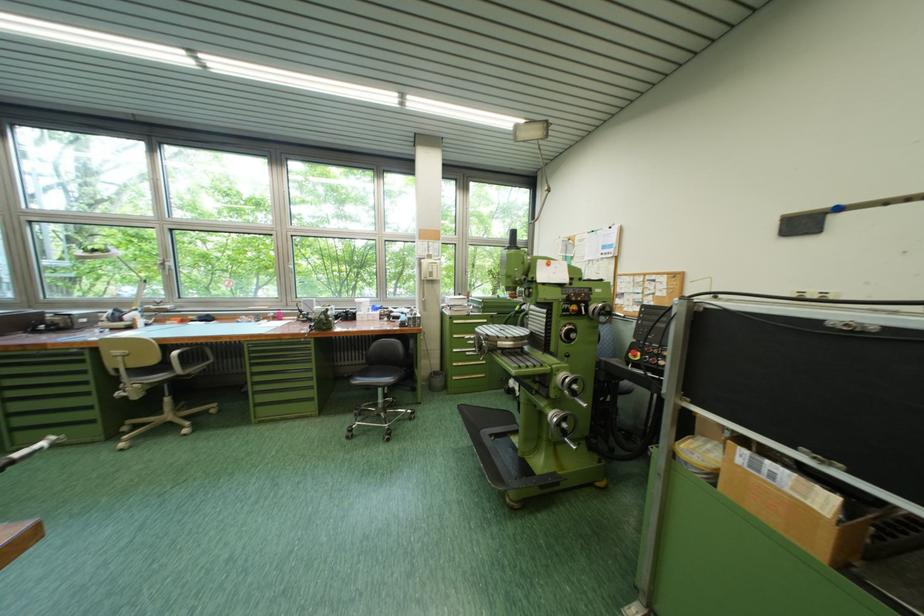
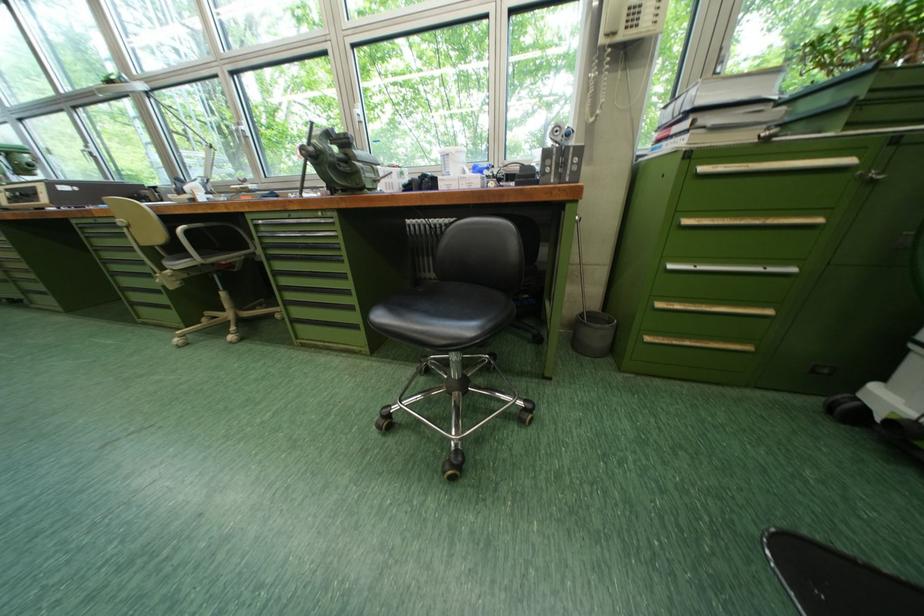
In the second image, find the point that corresponds to (x=466, y=323) in the first image.

(713, 169)